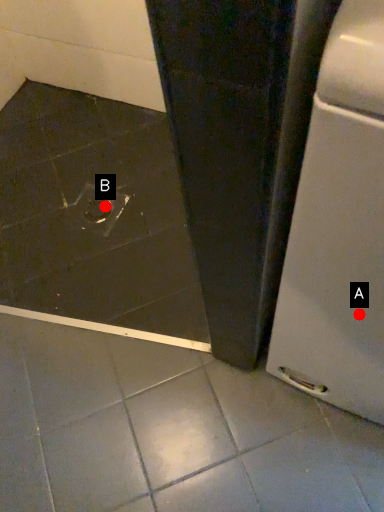
Question: Two points are circled on the image, labeled by A and B beside each circle. Which point is closer to the camera?

Choices:
 (A) A is closer
 (B) B is closer

Answer: (A)